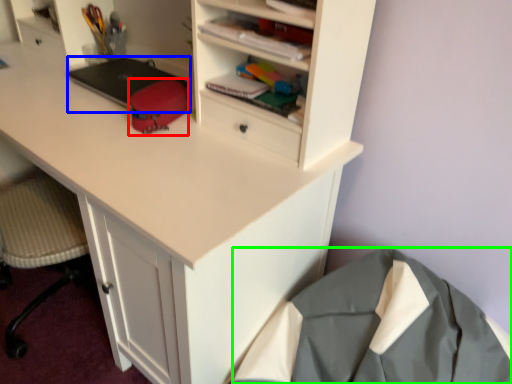
Question: Which object is the farthest from stationery (highlighted by a red box)? Choose among these: laptop (highlighted by a blue box) or clothing (highlighted by a green box).

Choices:
 (A) laptop
 (B) clothing

Answer: (B)